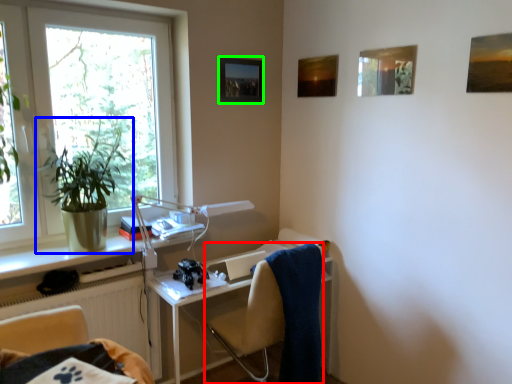
Question: Based on their relative distances, which object is nearer to chair (highlighted by a red box)? Choose from houseplant (highlighted by a blue box) and picture frame (highlighted by a green box).

Choices:
 (A) houseplant
 (B) picture frame

Answer: (A)